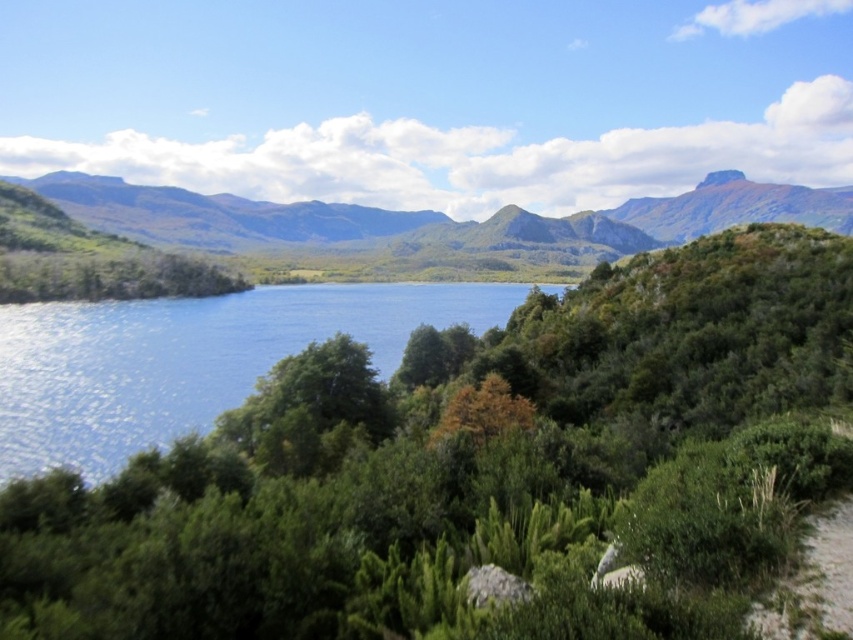
Can you confirm if green leafy tree at center is positioned above green grass at lower right?

Correct, green leafy tree at center is located above green grass at lower right.

Can you confirm if green leafy tree at center is bigger than green grass at lower right?

Yes.

Where is `green leafy tree at center`? This screenshot has height=640, width=853. green leafy tree at center is located at coordinates (480, 470).

Consider the image. Does blue liquid water at center come behind green grass at lower right?

Yes, blue liquid water at center is further from the viewer.

Which is more to the left, blue liquid water at center or green grass at lower right?

Positioned to the left is blue liquid water at center.

You are a GUI agent. You are given a task and a screenshot of the screen. Output one action in this format:
    pyautogui.click(x=<x>, y=<y>)
    Task: Click on the blue liquid water at center
    
    Given the screenshot: What is the action you would take?
    pyautogui.click(x=189, y=358)

Who is more forward, (x=651, y=324) or (x=329, y=292)?

Point (x=651, y=324) is in front.

I want to click on green leafy tree at center, so click(x=480, y=470).